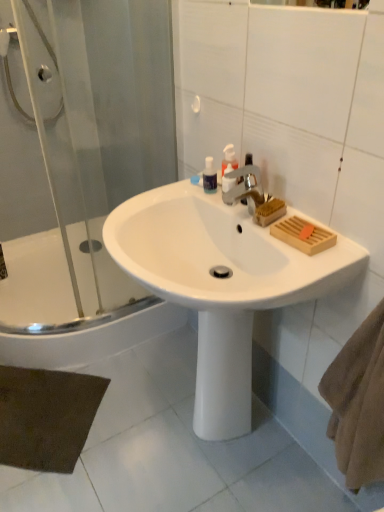
Question: Is white glossy bathtub at lower left taller than transparent plastic mouthwash at upper center?

Choices:
 (A) yes
 (B) no

Answer: (A)

Question: Is white glossy bathtub at lower left outside of transparent plastic mouthwash at upper center?

Choices:
 (A) yes
 (B) no

Answer: (A)

Question: Does white glossy bathtub at lower left turn towards transparent plastic mouthwash at upper center?

Choices:
 (A) yes
 (B) no

Answer: (B)

Question: Would you say white glossy bathtub at lower left is a long distance from transparent plastic mouthwash at upper center?

Choices:
 (A) no
 (B) yes

Answer: (B)

Question: Is white glossy bathtub at lower left at the right side of transparent plastic mouthwash at upper center?

Choices:
 (A) yes
 (B) no

Answer: (B)

Question: Does white glossy bathtub at lower left have a larger size compared to transparent plastic mouthwash at upper center?

Choices:
 (A) yes
 (B) no

Answer: (A)

Question: Is the position of transparent plastic mouthwash at upper center more distant than that of translucent plastic soap dispenser at upper center?

Choices:
 (A) yes
 (B) no

Answer: (A)

Question: Is transparent plastic mouthwash at upper center closer to the viewer compared to translucent plastic soap dispenser at upper center?

Choices:
 (A) yes
 (B) no

Answer: (B)

Question: Considering the relative positions of transparent plastic mouthwash at upper center and translucent plastic soap dispenser at upper center in the image provided, is transparent plastic mouthwash at upper center to the right of translucent plastic soap dispenser at upper center from the viewer's perspective?

Choices:
 (A) no
 (B) yes

Answer: (A)

Question: Could you tell me if transparent plastic mouthwash at upper center is turned towards translucent plastic soap dispenser at upper center?

Choices:
 (A) yes
 (B) no

Answer: (B)

Question: From a real-world perspective, is transparent plastic mouthwash at upper center located higher than translucent plastic soap dispenser at upper center?

Choices:
 (A) yes
 (B) no

Answer: (B)

Question: Can you confirm if transparent plastic mouthwash at upper center is bigger than translucent plastic soap dispenser at upper center?

Choices:
 (A) no
 (B) yes

Answer: (A)

Question: Is white glossy sink at center shorter than transparent glass shower door at left?

Choices:
 (A) yes
 (B) no

Answer: (A)